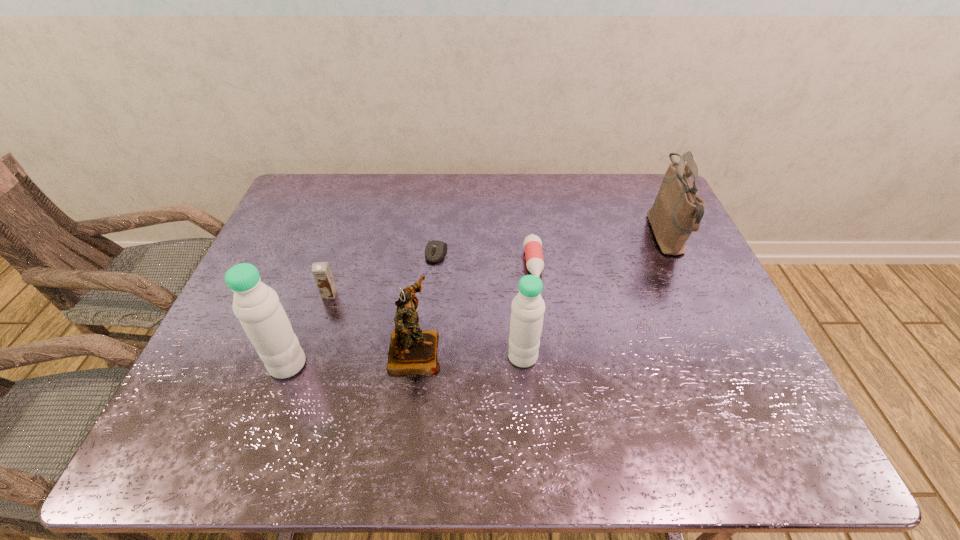
At what (x,y) coordinates should I click in order to perform the action: click on free space located on the left of the computer equipment. Please return your answer as a coordinate pair (x, y). The height and width of the screenshot is (540, 960). Looking at the image, I should click on (368, 253).

Locate an element on the screen. This screenshot has width=960, height=540. free space located 0.320m on the front-facing side of the rightmost object is located at coordinates (544, 237).

Locate an element on the screen. vacant region located 0.160m on the front-facing side of the rightmost object is located at coordinates (597, 237).

The height and width of the screenshot is (540, 960). Find the location of `vacant region located on the front-facing side of the rightmost object`. vacant region located on the front-facing side of the rightmost object is located at coordinates tap(570, 237).

At what (x,y) coordinates should I click in order to perform the action: click on vacant area situated 0.330m with the cap open on the sixth tallest object. Please return your answer as a coordinate pair (x, y). Looking at the image, I should click on (550, 400).

Locate an element on the screen. The width and height of the screenshot is (960, 540). free region located on the front-facing side of the figurine is located at coordinates (567, 351).

Identify the location of free location located on the left of the chocolate milk. This screenshot has width=960, height=540. (263, 294).

At what (x,y) coordinates should I click in order to perform the action: click on object located at the far edge. Please return your answer as a coordinate pair (x, y). Looking at the image, I should click on (677, 211).

I want to click on water bottle present at the near edge, so point(256,305).

Locate an element on the screen. This screenshot has height=540, width=960. figurine that is positioned at the near edge is located at coordinates (412, 351).